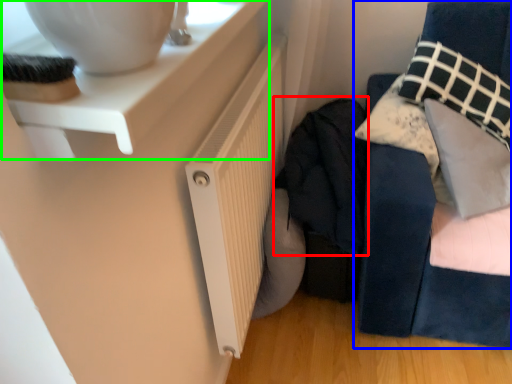
Question: Which is farther away from clothing (highlighted by a red box)? furniture (highlighted by a blue box) or table (highlighted by a green box)?

Choices:
 (A) furniture
 (B) table

Answer: (B)